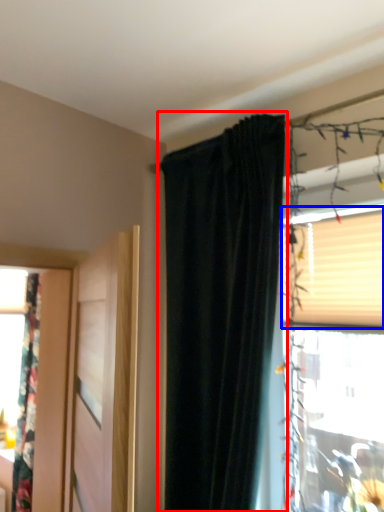
Question: Which object appears closest to the camera in this image, curtain (highlighted by a red box) or blind (highlighted by a blue box)?

Choices:
 (A) curtain
 (B) blind

Answer: (A)